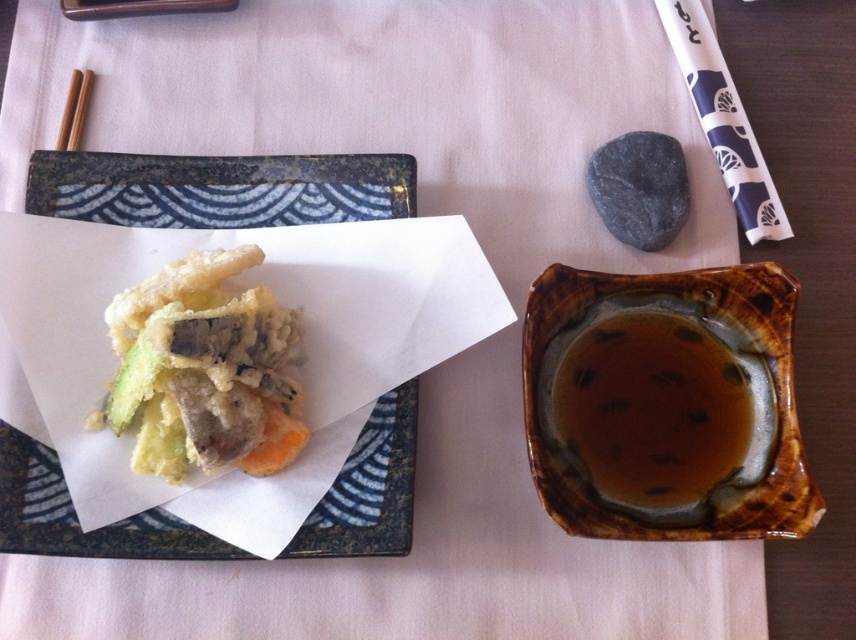
How much distance is there between brown glazed bowl at upper right and brown glazed bowl at right?

They are 0.47 inches apart.

Is point (623, 483) positioned before point (703, 406)?

Yes, it is.

What do you see at coordinates (666, 404) in the screenshot?
I see `brown glazed bowl at upper right` at bounding box center [666, 404].

Find the location of `brown glazed bowl at upper right`. brown glazed bowl at upper right is located at coordinates (666, 404).

Which is more to the left, textured paper plate at upper left or white crispy tempura at center?

textured paper plate at upper left

Is textured paper plate at upper left smaller than white crispy tempura at center?

No, textured paper plate at upper left is not smaller than white crispy tempura at center.

Measure the distance between textured paper plate at upper left and camera.

A distance of 19.54 inches exists between textured paper plate at upper left and camera.

You are a GUI agent. You are given a task and a screenshot of the screen. Output one action in this format:
    pyautogui.click(x=<x>, y=<y>)
    Task: Click on the textured paper plate at upper left
    The height and width of the screenshot is (640, 856).
    Given the screenshot: What is the action you would take?
    pyautogui.click(x=218, y=188)

Which of these two, black stone at upper right or brown wood chopsticks at upper left, stands shorter?

brown wood chopsticks at upper left is shorter.

Does point (593, 192) come closer to viewer compared to point (73, 109)?

Yes, point (593, 192) is in front of point (73, 109).

Identify the location of black stone at upper right. (639, 188).